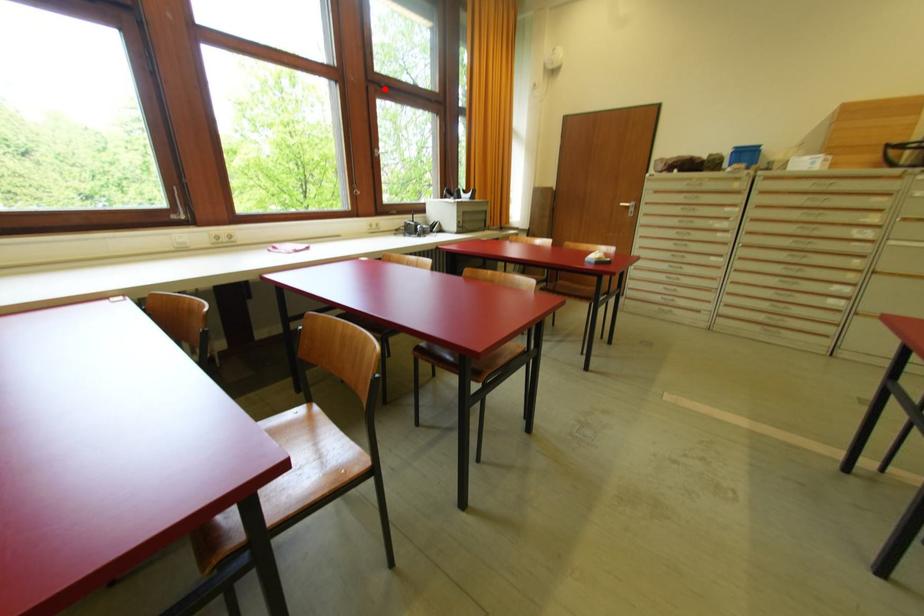
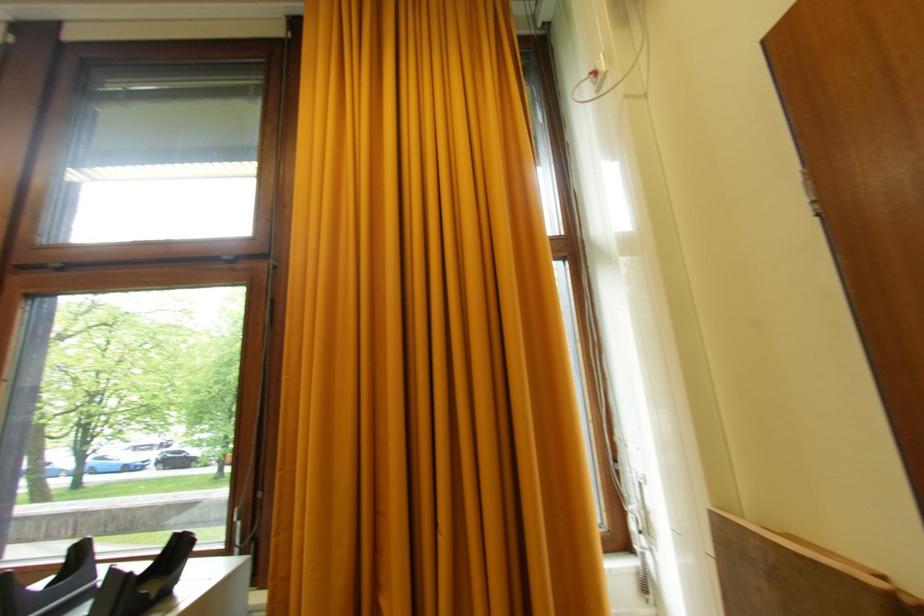
The point at the highlighted location is marked in the first image. Where is the corresponding point in the second image?

(62, 272)